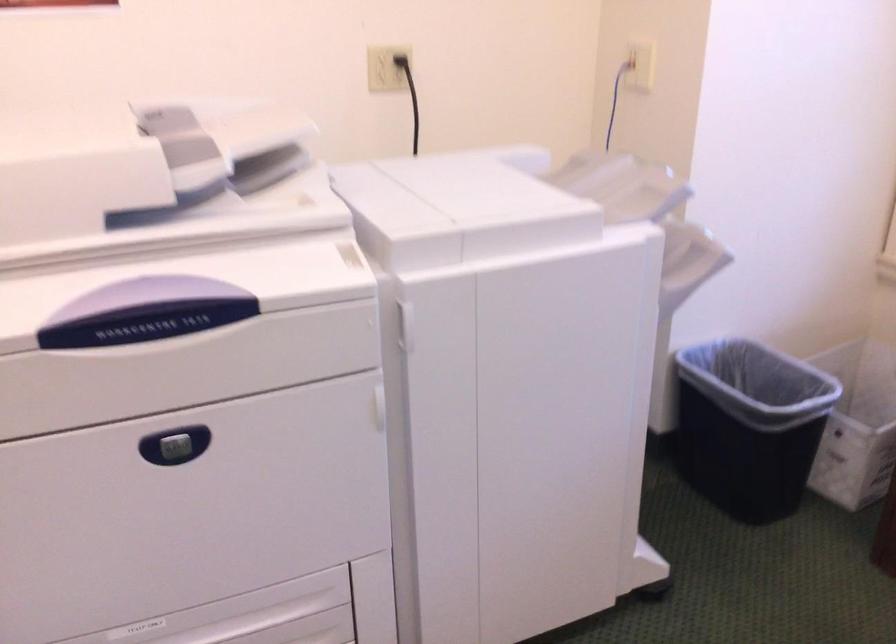
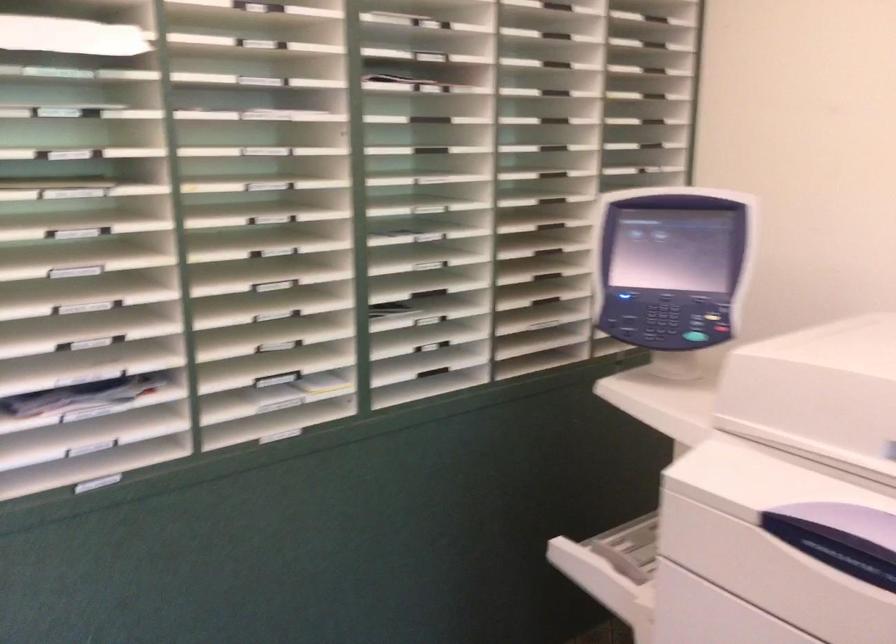
Question: Based on the continuous images, in which direction is the camera rotating? Reply with the corresponding letter.

Choices:
 (A) Left
 (B) Right
 (C) Up
 (D) Down

Answer: (A)